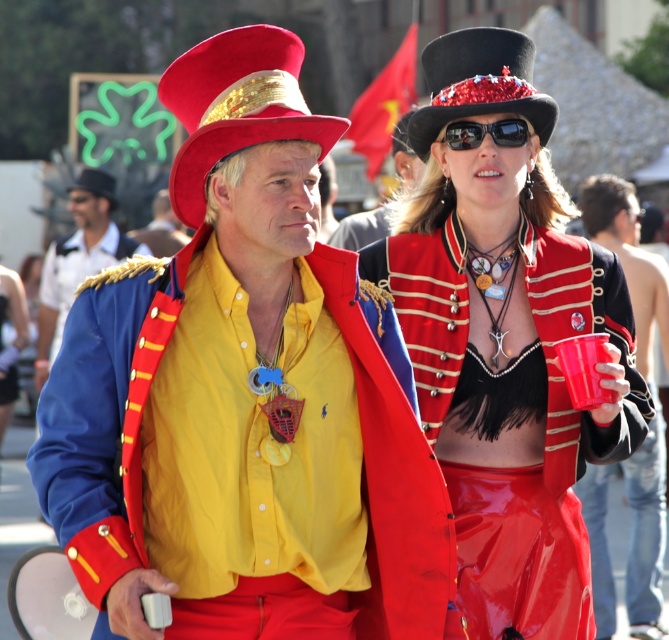
Question: Can you confirm if shiny red coat at center is positioned to the right of matte gold/red hat at center?

Choices:
 (A) no
 (B) yes

Answer: (B)

Question: Does shiny red pants at center appear on the left side of matte gold hat at upper center?

Choices:
 (A) no
 (B) yes

Answer: (A)

Question: Which point appears farthest from the camera in this image?

Choices:
 (A) (359, 241)
 (B) (189, 154)

Answer: (A)

Question: Which object appears closest to the camera in this image?

Choices:
 (A) black reflective sunglasses at upper center
 (B) blue satin jacket at left
 (C) shiny red coat at center

Answer: (C)

Question: Estimate the real-world distances between objects in this image. Which object is closer to the shiny red coat at center?

Choices:
 (A) shiny red skirt at center
 (B) red plastic cup at center right

Answer: (B)

Question: Does shiny red fabric top hat at upper center come behind shiny red skirt at center?

Choices:
 (A) no
 (B) yes

Answer: (A)